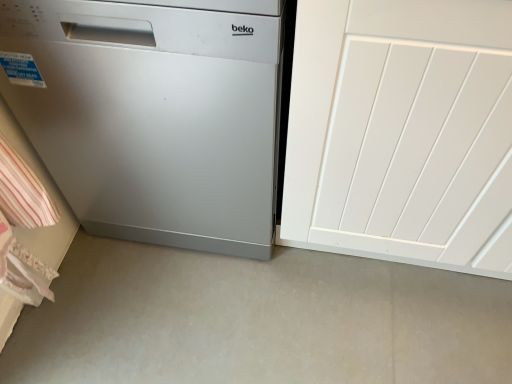
Question: Does white painted wood door at right have a greater width compared to satin silver dishwasher at left?

Choices:
 (A) yes
 (B) no

Answer: (A)

Question: Is white painted wood door at right beside satin silver dishwasher at left?

Choices:
 (A) yes
 (B) no

Answer: (B)

Question: Is white painted wood door at right facing away from satin silver dishwasher at left?

Choices:
 (A) yes
 (B) no

Answer: (B)

Question: Considering the relative sizes of white painted wood door at right and satin silver dishwasher at left in the image provided, is white painted wood door at right shorter than satin silver dishwasher at left?

Choices:
 (A) yes
 (B) no

Answer: (B)

Question: Can you confirm if white painted wood door at right is taller than satin silver dishwasher at left?

Choices:
 (A) yes
 (B) no

Answer: (A)

Question: Is white painted wood door at right behind satin silver dishwasher at left?

Choices:
 (A) yes
 (B) no

Answer: (B)

Question: From the image's perspective, is satin silver dishwasher at left located above white painted wood door at right?

Choices:
 (A) yes
 (B) no

Answer: (A)

Question: Does satin silver dishwasher at left come in front of white painted wood door at right?

Choices:
 (A) no
 (B) yes

Answer: (A)

Question: Does satin silver dishwasher at left turn towards white painted wood door at right?

Choices:
 (A) no
 (B) yes

Answer: (A)

Question: Does satin silver dishwasher at left have a greater height compared to white painted wood door at right?

Choices:
 (A) no
 (B) yes

Answer: (A)

Question: Would you say satin silver dishwasher at left is a long distance from white painted wood door at right?

Choices:
 (A) no
 (B) yes

Answer: (A)

Question: Are satin silver dishwasher at left and white painted wood door at right making contact?

Choices:
 (A) yes
 (B) no

Answer: (B)

Question: Is satin silver dishwasher at left inside the boundaries of white painted wood door at right, or outside?

Choices:
 (A) inside
 (B) outside

Answer: (B)